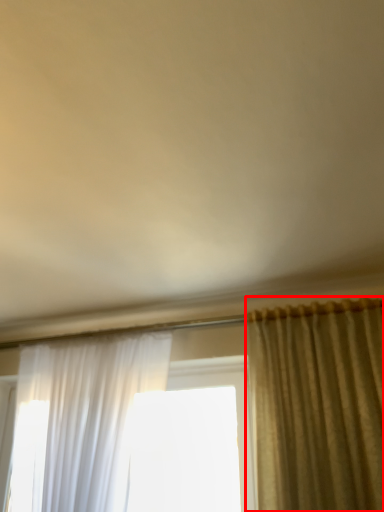
Question: Where is curtain (annotated by the red box) located in relation to curtain in the image?

Choices:
 (A) right
 (B) left

Answer: (A)